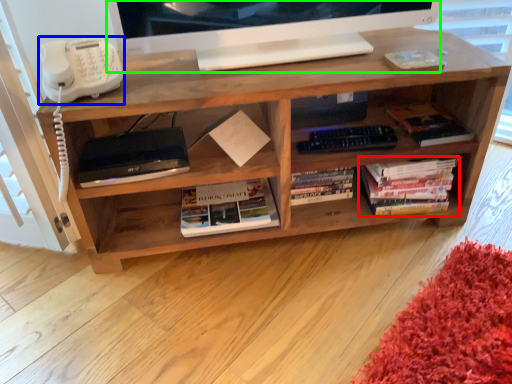
Question: Considering the real-world distances, which object is farthest from book (highlighted by a red box)? corded phone (highlighted by a blue box) or television (highlighted by a green box)?

Choices:
 (A) corded phone
 (B) television

Answer: (A)